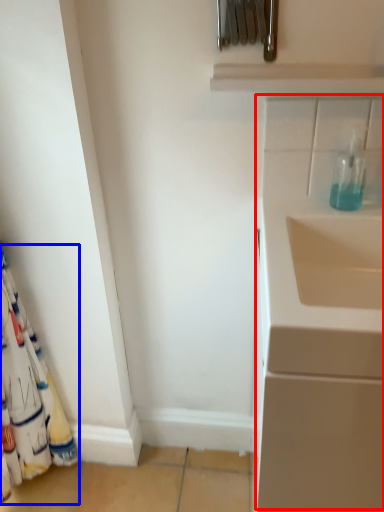
Question: Which object is further to the camera taking this photo, wide (highlighted by a red box) or curtain (highlighted by a blue box)?

Choices:
 (A) wide
 (B) curtain

Answer: (B)